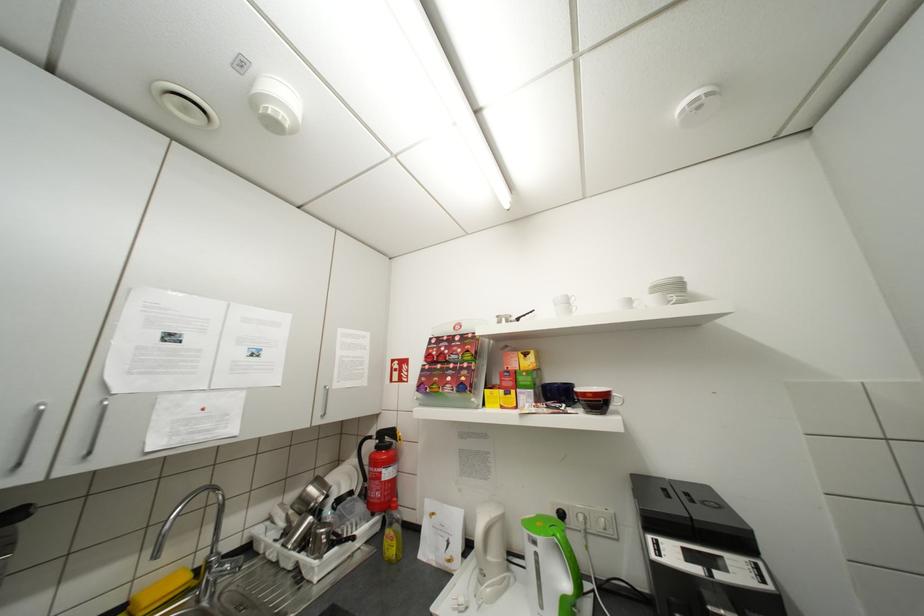
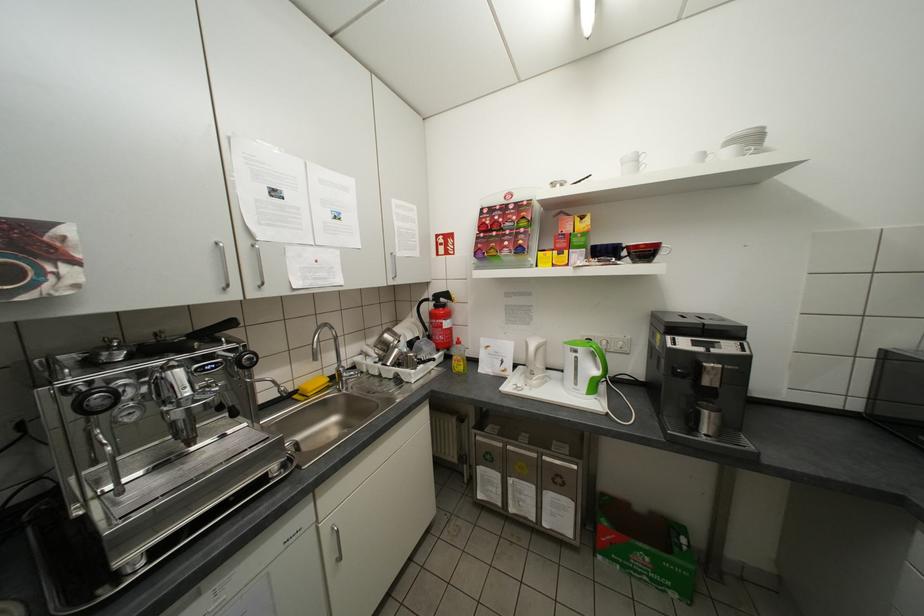
Where in the second image is the point corresponding to the point at 553,405 from the first image?

(603, 259)